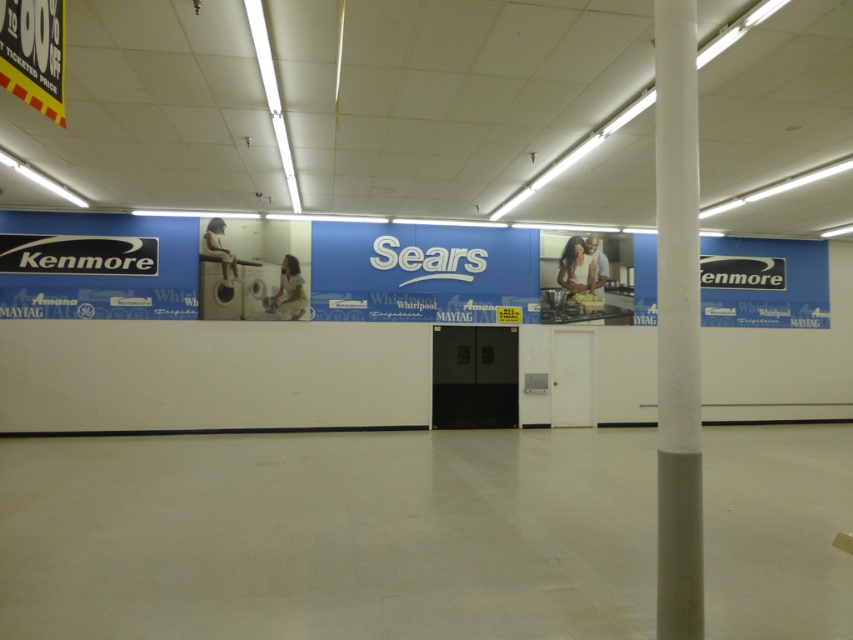
You are a customer in the Sears store and want to locate the white matte sign at center and the blue matte kenmore sign at upper right. Which one is bigger?

The white matte sign at center is larger in size than the blue matte kenmore sign at upper right.